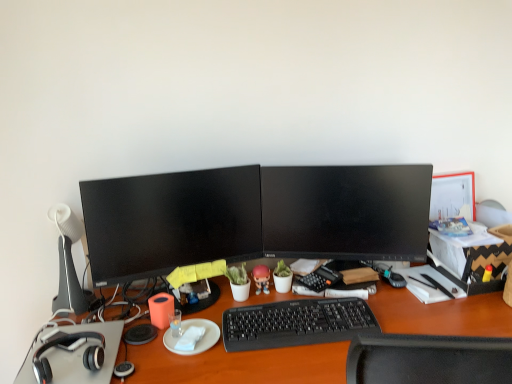
You are a GUI agent. You are given a task and a screenshot of the screen. Output one action in this format:
    pyautogui.click(x=<x>, y=<y>)
    Task: Click on the vacant space behind white paper at center
    
    Given the screenshot: What is the action you would take?
    pyautogui.click(x=206, y=313)